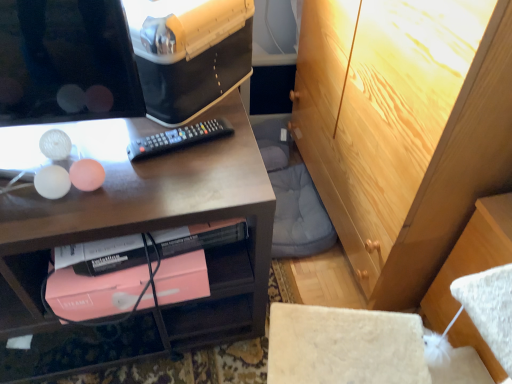
You are a GUI agent. You are given a task and a screenshot of the screen. Output one action in this format:
    pyautogui.click(x=<x>, y=<y>)
    Task: Click on the vacant region to the left of black plastic remote at center
    The height and width of the screenshot is (384, 512).
    Given the screenshot: What is the action you would take?
    click(x=105, y=151)